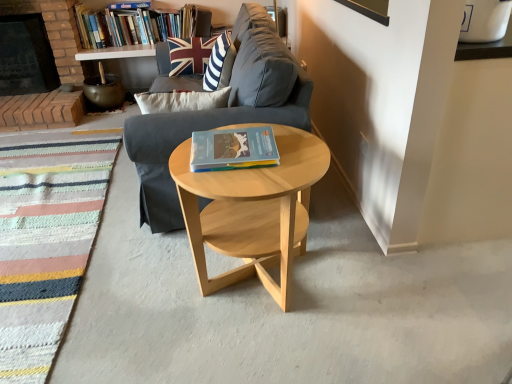
Where is `vacant space underneath natural wood side table at center (from a real-world perspective)`? This screenshot has width=512, height=384. vacant space underneath natural wood side table at center (from a real-world perspective) is located at coordinates (266, 296).